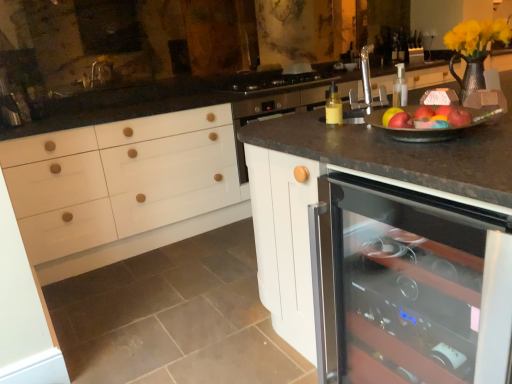
Where is `free point to the right of red matte apple at upper right, the 3th apple in the left-to-right sequence`? free point to the right of red matte apple at upper right, the 3th apple in the left-to-right sequence is located at coordinates (490, 126).